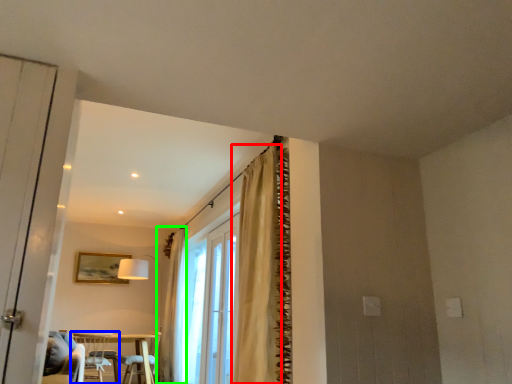
Question: Considering the real-world distances, which object is closest to curtain (highlighted by a red box)? chair (highlighted by a blue box) or curtain (highlighted by a green box).

Choices:
 (A) chair
 (B) curtain

Answer: (B)